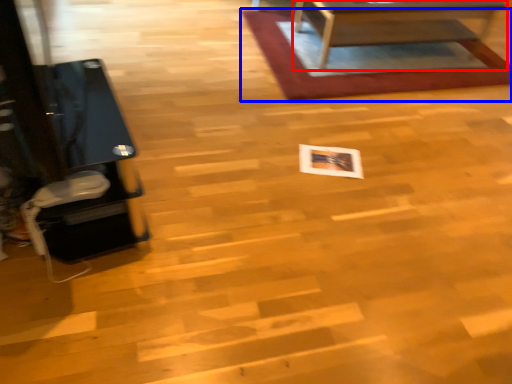
Question: Among these objects, which one is nearest to the camera, table (highlighted by a red box) or mat (highlighted by a blue box)?

Choices:
 (A) table
 (B) mat

Answer: (A)